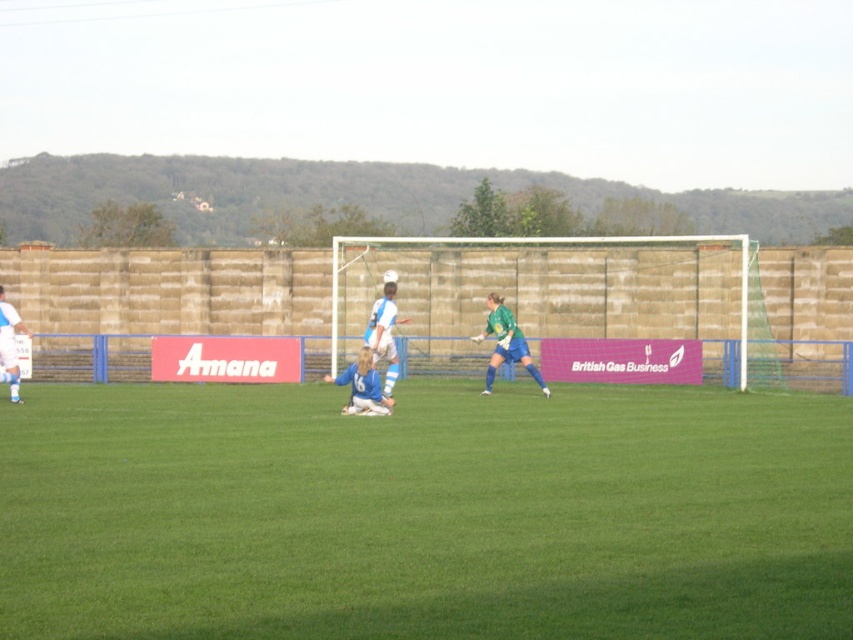
Image resolution: width=853 pixels, height=640 pixels. Describe the element at coordinates (384, 330) in the screenshot. I see `white matte soccer ball at center` at that location.

Is white matte soccer ball at center thinner than blue jersey at center?

Yes, white matte soccer ball at center is thinner than blue jersey at center.

This screenshot has height=640, width=853. What do you see at coordinates (384, 330) in the screenshot? I see `white matte soccer ball at center` at bounding box center [384, 330].

Locate an element on the screen. The width and height of the screenshot is (853, 640). white matte soccer ball at center is located at coordinates (384, 330).

In the scene shown: Does green grass at center have a lesser width compared to white matte soccer ball at center?

Incorrect, green grass at center's width is not less than white matte soccer ball at center's.

Can you confirm if green grass at center is positioned to the left of white matte soccer ball at center?

In fact, green grass at center is to the right of white matte soccer ball at center.

Is point (648, 388) less distant than point (372, 344)?

No.

Find the location of a particular element. Image resolution: width=853 pixels, height=640 pixels. green grass at center is located at coordinates (424, 515).

Is white net at center further to camera compared to white matte soccer ball at center?

Yes, it is.

Who is more distant from viewer, [437,314] or [386,348]?

Positioned behind is point [437,314].

Measure the distance between white net at center and camera.

white net at center and camera are 29.84 meters apart from each other.

The image size is (853, 640). I want to click on white net at center, so click(566, 292).